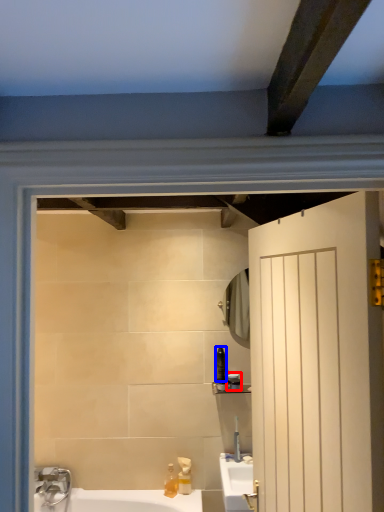
Question: Among these objects, which one is farthest to the camera, toiletry (highlighted by a red box) or toiletry (highlighted by a blue box)?

Choices:
 (A) toiletry
 (B) toiletry

Answer: (A)